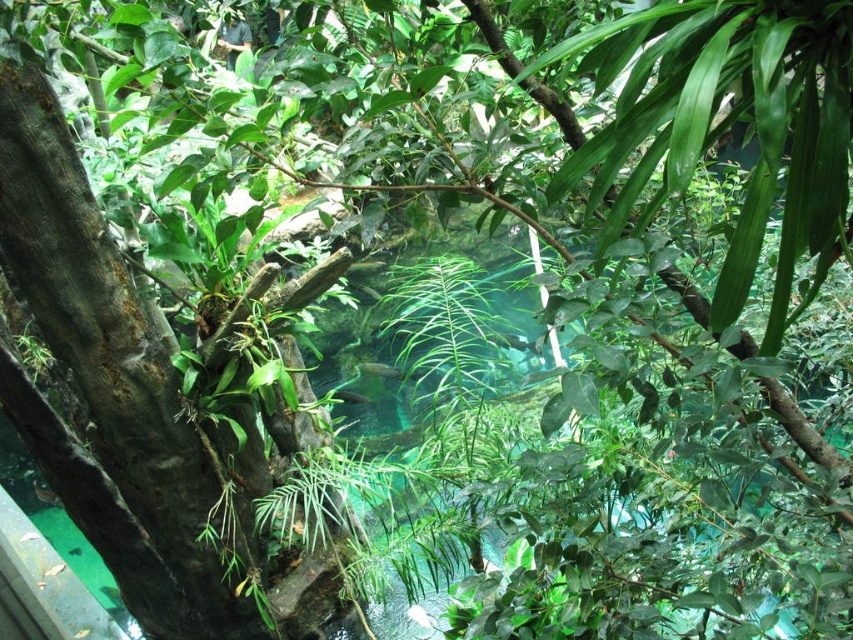
You are observing two fish at the center of a tropical environment. The green glossy fish at center and the translucent green fish at center. Which fish is closer to you?

The green glossy fish at center is closer to the viewer than the translucent green fish at center.

You are standing in the tropical environment and see a point marked at coordinates [386,371]. What object is located at that point?

The point at coordinates [386,371] corresponds to the green glossy fish at center.